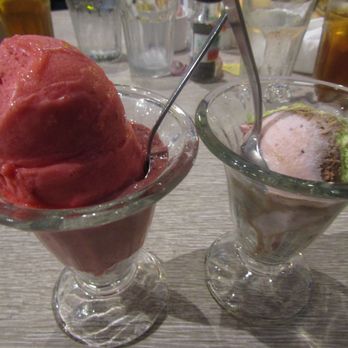
I want to click on table, so click(x=14, y=320).